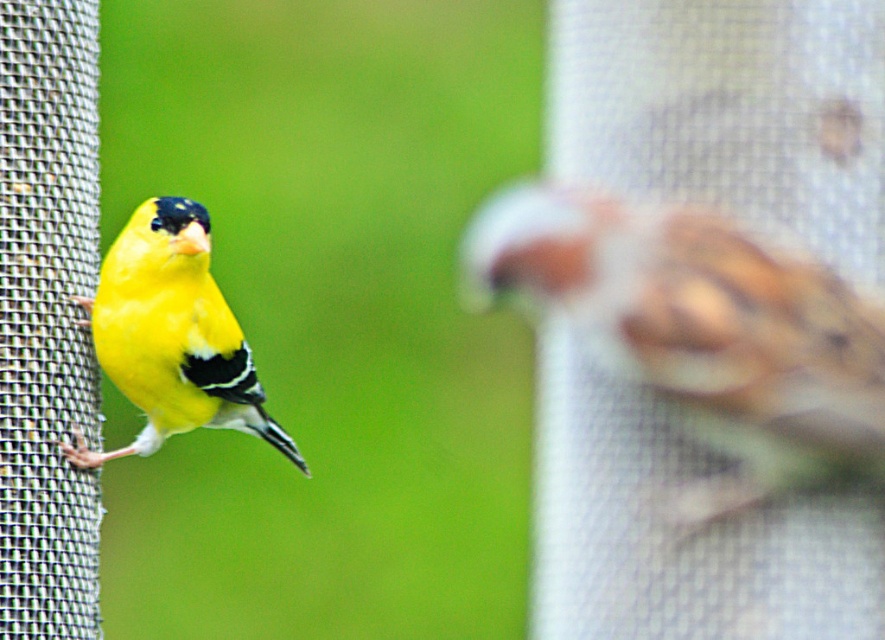
Question: Which point appears closest to the camera in this image?

Choices:
 (A) (763, 310)
 (B) (144, 321)

Answer: (A)

Question: Is brown speckled sparrow at right closer to camera compared to shiny yellow canary at left?

Choices:
 (A) no
 (B) yes

Answer: (B)

Question: Is brown speckled sparrow at right smaller than shiny yellow canary at left?

Choices:
 (A) no
 (B) yes

Answer: (B)

Question: Which object is farther from the camera taking this photo?

Choices:
 (A) brown speckled sparrow at right
 (B) shiny yellow canary at left

Answer: (B)

Question: Does brown speckled sparrow at right have a greater width compared to shiny yellow canary at left?

Choices:
 (A) no
 (B) yes

Answer: (B)